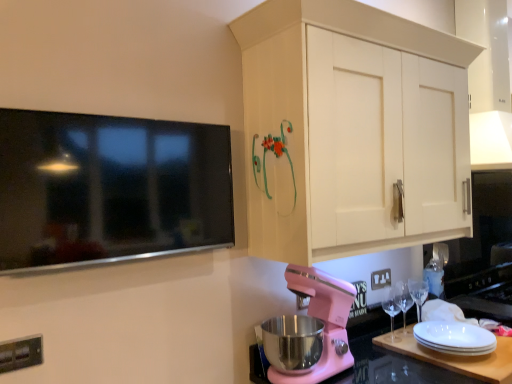
Question: From the image's perspective, does flat screen tv at upper left appear lower than clear glass wine glass at lower right, acting as the 1th wine glass starting from the left?

Choices:
 (A) no
 (B) yes

Answer: (A)

Question: Can you confirm if flat screen tv at upper left is bigger than clear glass wine glass at lower right, acting as the 1th wine glass starting from the left?

Choices:
 (A) no
 (B) yes

Answer: (B)

Question: Considering the relative sizes of flat screen tv at upper left and clear glass wine glass at lower right, the second wine glass positioned from the right, in the image provided, is flat screen tv at upper left shorter than clear glass wine glass at lower right, the second wine glass positioned from the right,?

Choices:
 (A) no
 (B) yes

Answer: (A)

Question: Is flat screen tv at upper left outside clear glass wine glass at lower right, the second wine glass positioned from the right?

Choices:
 (A) yes
 (B) no

Answer: (A)

Question: From the image's perspective, does flat screen tv at upper left appear higher than clear glass wine glass at lower right, acting as the 1th wine glass starting from the left?

Choices:
 (A) yes
 (B) no

Answer: (A)

Question: Is white plastic electric outlet at lower center, the 1th electric outlet when ordered from right to left, situated inside pink matte countertop at lower center or outside?

Choices:
 (A) inside
 (B) outside

Answer: (B)

Question: Looking at the image, does white plastic electric outlet at lower center, which is counted as the first electric outlet, starting from the back, seem bigger or smaller compared to pink matte countertop at lower center?

Choices:
 (A) big
 (B) small

Answer: (B)

Question: Looking at their shapes, would you say white plastic electric outlet at lower center, which is counted as the first electric outlet, starting from the back, is wider or thinner than pink matte countertop at lower center?

Choices:
 (A) wide
 (B) thin

Answer: (B)

Question: From their relative heights in the image, would you say white plastic electric outlet at lower center, acting as the second electric outlet starting from the left, is taller or shorter than pink matte countertop at lower center?

Choices:
 (A) tall
 (B) short

Answer: (B)

Question: Considering the positions of pink matte countertop at lower center and flat screen tv at upper left in the image, is pink matte countertop at lower center wider or thinner than flat screen tv at upper left?

Choices:
 (A) wide
 (B) thin

Answer: (A)

Question: From their relative heights in the image, would you say pink matte countertop at lower center is taller or shorter than flat screen tv at upper left?

Choices:
 (A) tall
 (B) short

Answer: (A)

Question: From a real-world perspective, is pink matte countertop at lower center positioned above or below flat screen tv at upper left?

Choices:
 (A) below
 (B) above

Answer: (A)

Question: From the image's perspective, is pink matte countertop at lower center located above or below flat screen tv at upper left?

Choices:
 (A) above
 (B) below

Answer: (B)

Question: Considering their positions, is transparent glass wine glass at lower right, which is counted as the 2th wine glass, starting from the left, located in front of or behind pink matte countertop at lower center?

Choices:
 (A) front
 (B) behind

Answer: (B)

Question: From the image's perspective, is transparent glass wine glass at lower right, the 1th wine glass from the right, located above or below pink matte countertop at lower center?

Choices:
 (A) above
 (B) below

Answer: (A)